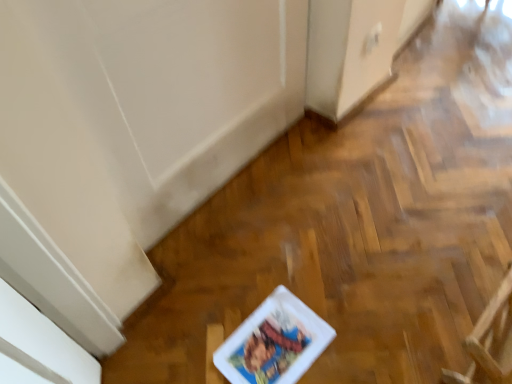
The height and width of the screenshot is (384, 512). I want to click on blank space above white glossy comic book at center (from a real-world perspective), so click(x=272, y=332).